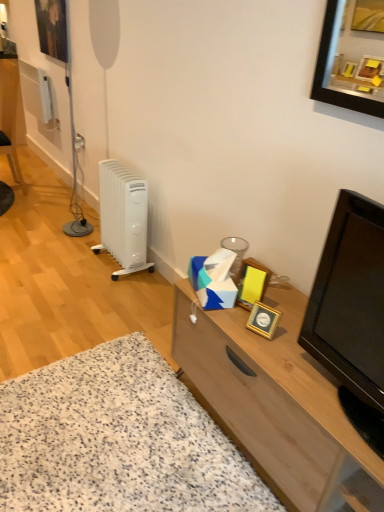
You are a GUI agent. You are given a task and a screenshot of the screen. Output one action in this format:
    pyautogui.click(x=<x>, y=<y>)
    Task: Click on the free space to the back side of gold metallic picture frame at center-right, which ranks as the 1th picture frame in bottom-to-top order
    The image size is (384, 512).
    Given the screenshot: What is the action you would take?
    pyautogui.click(x=285, y=302)